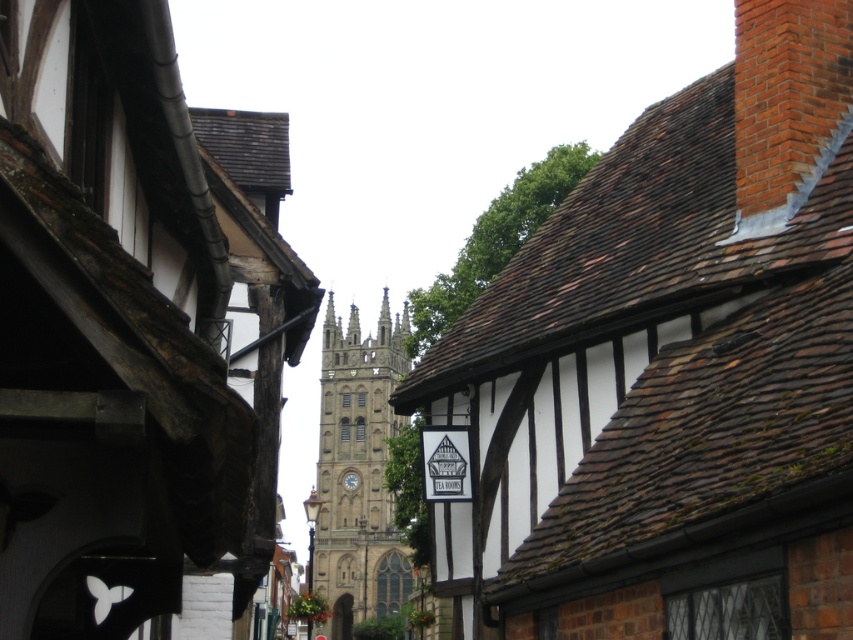
Question: Does brown stone tower at center appear on the right side of stone gothic tower at center?

Choices:
 (A) yes
 (B) no

Answer: (A)

Question: Is brown stone tower at center bigger than stone gothic tower at center?

Choices:
 (A) no
 (B) yes

Answer: (A)

Question: Does brown tiled roof at upper center have a larger size compared to brown stone tower at center?

Choices:
 (A) no
 (B) yes

Answer: (B)

Question: Which object appears closest to the camera in this image?

Choices:
 (A) brown tiled roof at upper center
 (B) stone gothic tower at center

Answer: (A)

Question: Which object is positioned farthest from the brown stone tower at center?

Choices:
 (A) brown tiled roof at upper center
 (B) stone gothic tower at center

Answer: (B)

Question: Which point appears closest to the camera in this image?

Choices:
 (A) (178, 104)
 (B) (338, 529)
 (C) (755, 419)

Answer: (C)